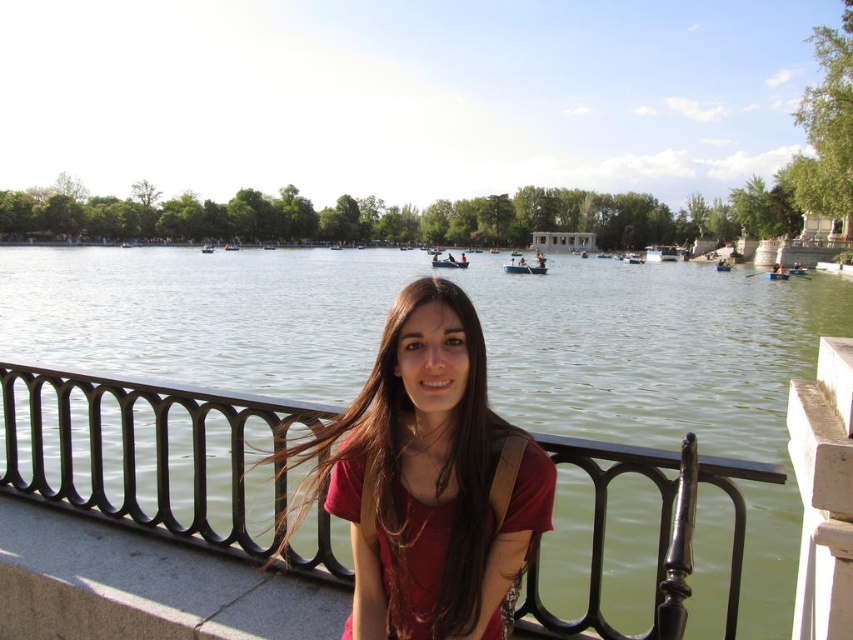
Question: Among these objects, which one is farthest from the camera?

Choices:
 (A) matte red dress at center
 (B) black metal railing at center

Answer: (A)

Question: Is black metal railing at center behind wooden rowboat at center?

Choices:
 (A) no
 (B) yes

Answer: (A)

Question: Among these points, which one is farthest from the camera?

Choices:
 (A) (517, 268)
 (B) (519, 506)
 (C) (451, 257)

Answer: (C)

Question: Based on their relative distances, which object is nearer to the black metal railing at center?

Choices:
 (A) wooden rowboat at center
 (B) matte red shirt at center
 (C) wooden boat at center

Answer: (B)

Question: Is matte red shirt at center thinner than wooden rowboat at center?

Choices:
 (A) yes
 (B) no

Answer: (A)

Question: Does black metal railing at center have a lesser width compared to matte red shirt at center?

Choices:
 (A) no
 (B) yes

Answer: (A)